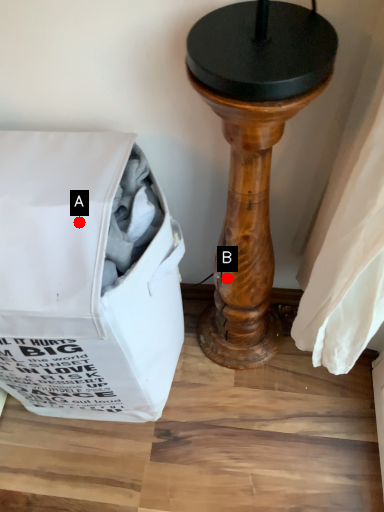
Question: Two points are circled on the image, labeled by A and B beside each circle. Which point appears closest to the camera in this image?

Choices:
 (A) A is closer
 (B) B is closer

Answer: (A)